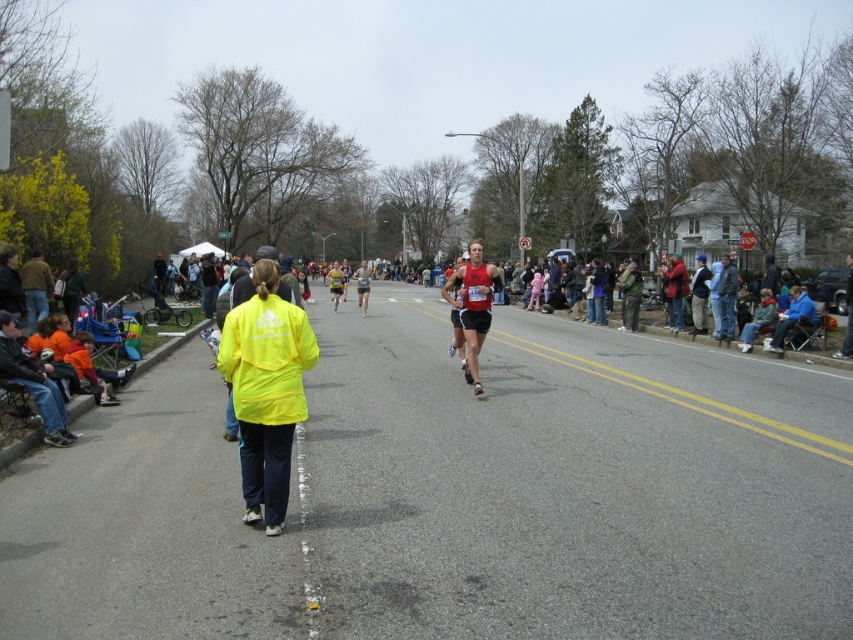
You are a participant in the marathon and you want to stay within the race route. The race route is between the double yellow lines on the asphalt road. Where should you position yourself relative to the yellow fabric jacket at center?

You should position yourself to the right of the yellow fabric jacket at center because the race route is between the double yellow lines, and the jacket is located at point (265, 388) which is on the left edge of the road.

In the scene shown: You are a photographer positioned at the starting line of the marathon. You want to capture a photo that includes both the yellow fabric jacket at center and the red matte running suit at center. Since you want to focus on the runner, which object should you zoom in on more to ensure the runner is the main subject?

You should zoom in more on the red matte running suit at center because its width is larger than the yellow fabric jacket at center, making it easier to focus on the runner as the main subject.